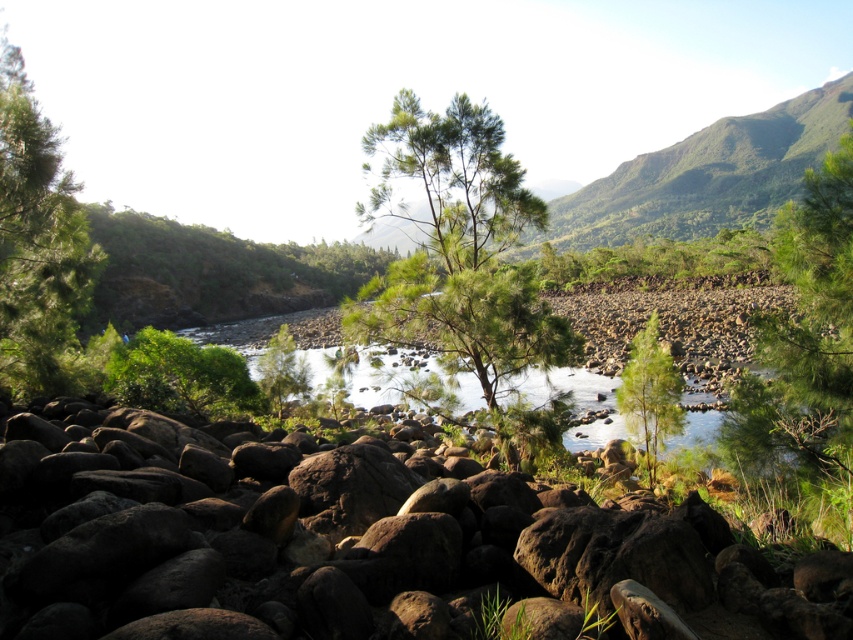
You are a GUI agent. You are given a task and a screenshot of the screen. Output one action in this format:
    pyautogui.click(x=<x>, y=<y>)
    Task: Click on the green matte tree at right
    This screenshot has height=640, width=853.
    Given the screenshot: What is the action you would take?
    pyautogui.click(x=805, y=339)

Between green matte tree at right and green matte tree at center, which one appears on the right side from the viewer's perspective?

Positioned to the right is green matte tree at right.

Is point (833, 372) positioned in front of point (271, 390)?

Yes, point (833, 372) is in front of point (271, 390).

I want to click on green matte tree at right, so click(805, 339).

Does green matte tree at left have a smaller size compared to green leafy tree at center?

Yes, green matte tree at left is smaller than green leafy tree at center.

Is green matte tree at left wider than green leafy tree at center?

No, green matte tree at left is not wider than green leafy tree at center.

The width and height of the screenshot is (853, 640). Describe the element at coordinates (38, 244) in the screenshot. I see `green matte tree at left` at that location.

Locate an element on the screen. The height and width of the screenshot is (640, 853). green matte tree at left is located at coordinates (38, 244).

Which of these two, green matte tree at right or green matte tree at left, stands shorter?

Standing shorter between the two is green matte tree at left.

Where is `green matte tree at right`? The width and height of the screenshot is (853, 640). green matte tree at right is located at coordinates (805, 339).